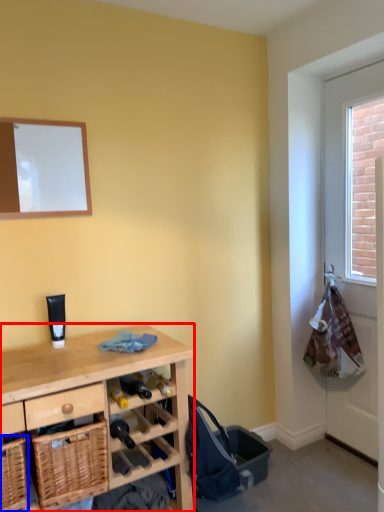
Question: Which object appears farthest to the camera in this image, desk (highlighted by a red box) or basket (highlighted by a blue box)?

Choices:
 (A) desk
 (B) basket

Answer: (B)